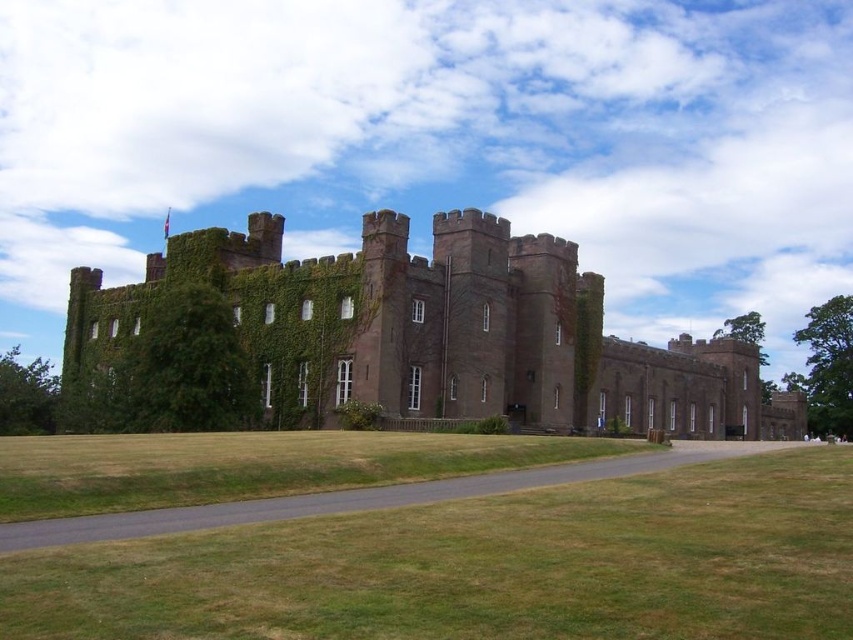
You are standing at the entrance of the brown stone castle at center. If you walk straight ahead, will you step onto the lawn or the paved pathway?

The brown stone castle at center is located at point (439, 332), so walking straight ahead from the entrance would lead you onto the lawn since the paved pathway runs parallel to it but not directly in front.

You are a tour guide standing on the lawn in front of the brown stone castle at center. You want to lead visitors to the green ivy at left, which is growing on the castle wall. Can you walk straight from your current position to the ivy without crossing the paved pathway?

The distance between the brown stone castle at center and the green ivy at left is 16.03 meters. Since the paved pathway is parallel to the lawn and the ivy is on the castle wall, you can walk straight towards the ivy without crossing the pathway.